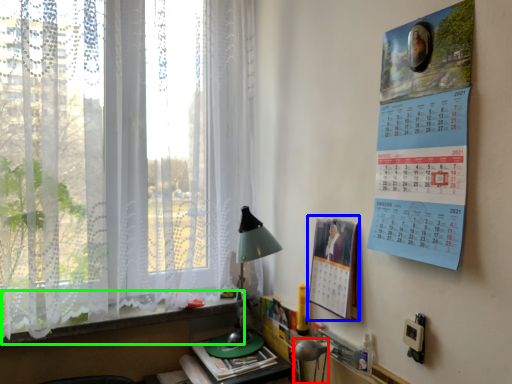
Question: Which object is positioned closest to table lamp (highlighted by a red box)? Select from poster page (highlighted by a blue box) and window sill (highlighted by a green box).

Choices:
 (A) poster page
 (B) window sill

Answer: (A)